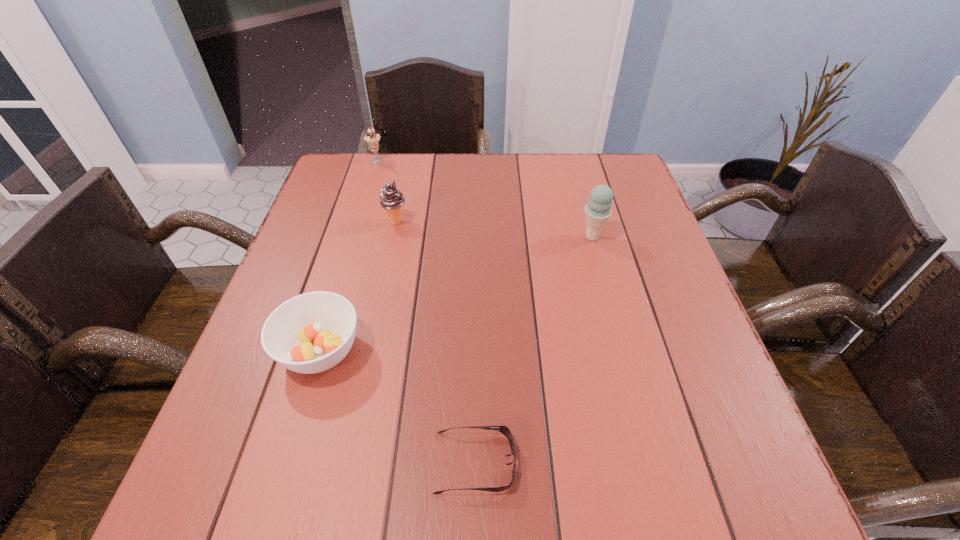
This screenshot has height=540, width=960. Find the location of `free space that is in between the second icecream from right to left and the rightmost icecream`. free space that is in between the second icecream from right to left and the rightmost icecream is located at coordinates (494, 230).

At what (x,y) coordinates should I click in order to perform the action: click on free space between the rightmost object and the fourth object from left to right. Please return your answer as a coordinate pair (x, y). The width and height of the screenshot is (960, 540). Looking at the image, I should click on (534, 349).

You are a GUI agent. You are given a task and a screenshot of the screen. Output one action in this format:
    pyautogui.click(x=<x>, y=<y>)
    Task: Click on the blank region between the soup bowl and the sunglasses
    
    Given the screenshot: What is the action you would take?
    pyautogui.click(x=397, y=407)

Find the location of a particular element. The height and width of the screenshot is (540, 960). free space between the second icecream from left to right and the rightmost object is located at coordinates (494, 230).

Where is `the closest object to the second icecream from right to left`? the closest object to the second icecream from right to left is located at coordinates (372, 138).

Identify which object is the second nearest to the second icecream from right to left. Please provide its 2D coordinates. Your answer should be formatted as a tuple, i.e. [(x, y)], where the tuple contains the x and y coordinates of a point satisfying the conditions above.

[(310, 333)]

Where is `the closest icecream relative to the second nearest object`? the closest icecream relative to the second nearest object is located at coordinates (392, 199).

Find the location of a particular element. Image resolution: width=960 pixels, height=540 pixels. icecream identified as the second closest to the nearest object is located at coordinates (392, 199).

Where is `vacant space that satisfies the following two spatial constraints: 1. on the front side of the farthest icecream; 2. on the left side of the soup bowl`? vacant space that satisfies the following two spatial constraints: 1. on the front side of the farthest icecream; 2. on the left side of the soup bowl is located at coordinates (319, 351).

Identify the location of blank area in the image that satisfies the following two spatial constraints: 1. on the front side of the fourth tallest object; 2. on the left side of the farthest icecream. (319, 351).